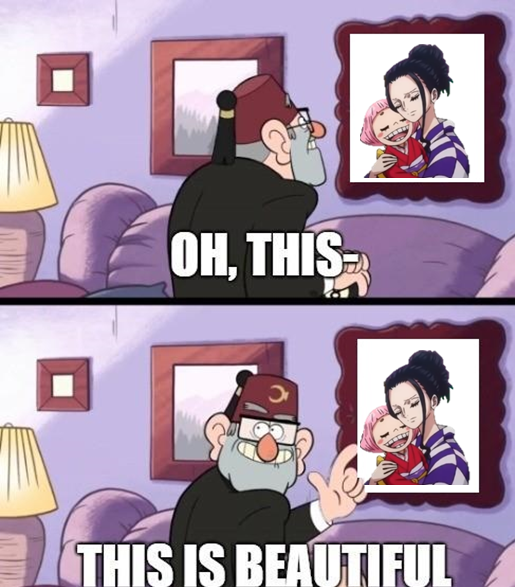
Find the location of a particular element. The height and width of the screenshot is (587, 515). blue background, wall is located at coordinates (93, 458).